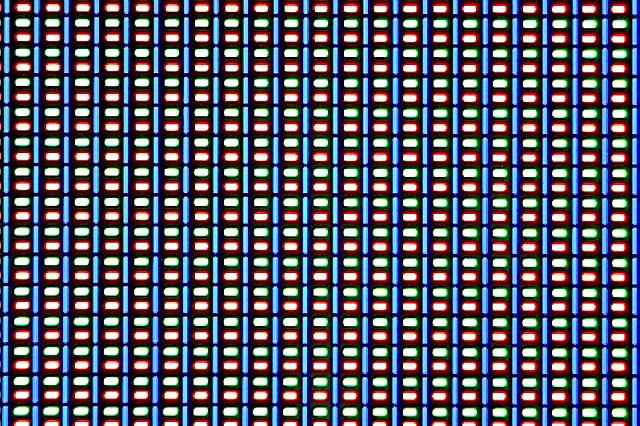
You are a GUI agent. You are given a task and a screenshot of the screen. Output one action in this format:
    pyautogui.click(x=<x>, y=<y>)
    Task: Click on the christmas tree colored lights
    The height and width of the screenshot is (426, 640).
    Given the screenshot: What is the action you would take?
    pyautogui.click(x=292, y=354), pyautogui.click(x=291, y=366)